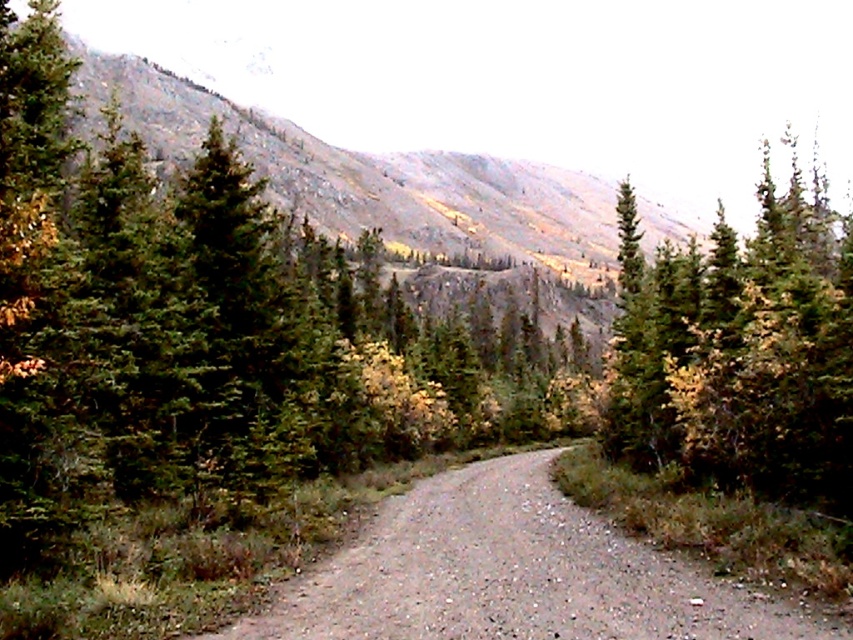
You are a hiker planning to walk along the gray gravel trail at center. You notice the green matte tree at upper right in the distance. Based on the scene, which object would appear closer to you when you start your hike?

The gray gravel trail at center would appear closer to you because it is at the center of the scene, while the green matte tree at upper right is positioned further back, making it appear farther away.

You are a hiker planning to walk along the gray gravel trail at center. You notice the green matte tree at upper right. Which object is closer to you, the hiker, as you stand at the start of the trail?

The green matte tree at upper right is closer to you than the gray gravel trail at center because it is positioned further to the viewer.

You are a hiker planning to walk along the gray gravel trail at center. You notice a green matte tree at upper right in the distance. Which object is wider?

The green matte tree at upper right is wider than the gray gravel trail at center.